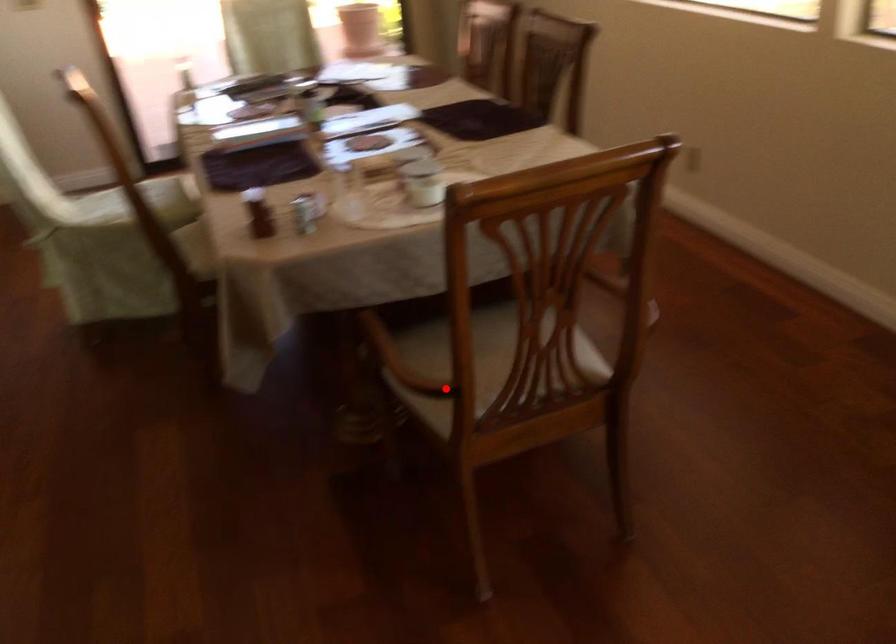
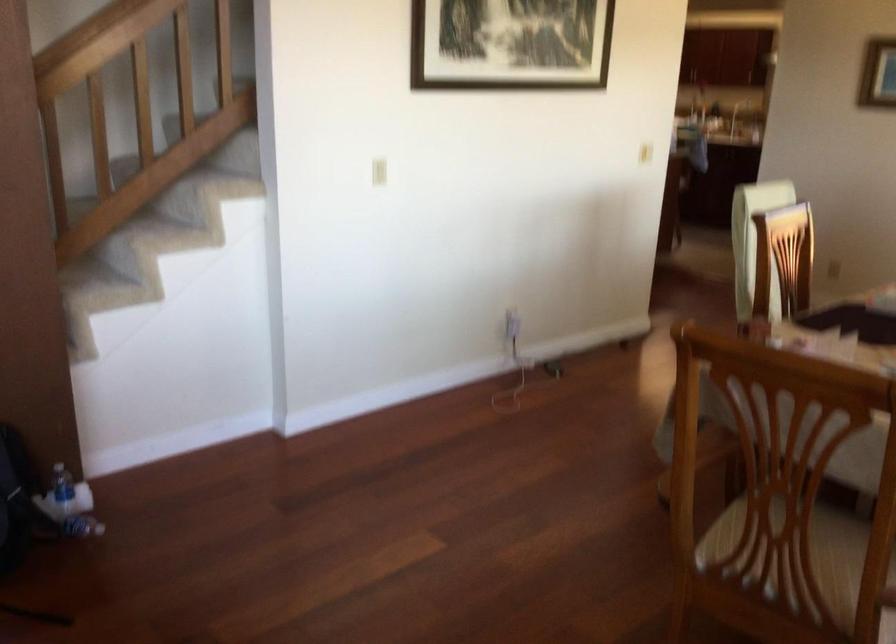
Question: I am providing you with two images of the same scene from different viewpoints. A red point is marked on the first image. At the location where the point appears in image 1, is it still visible in image 2?

Choices:
 (A) Yes
 (B) No

Answer: (A)